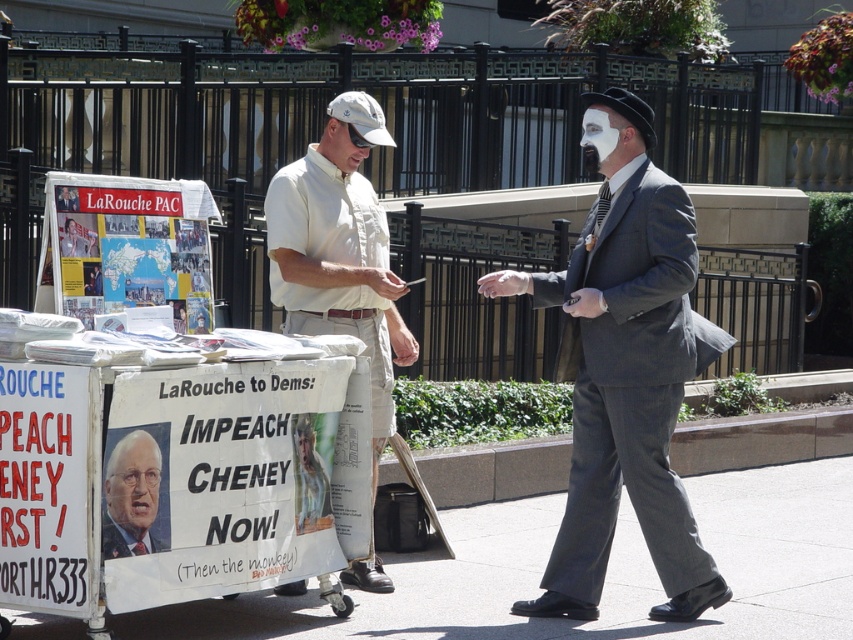
You are standing in front of the street vendor cart. There are two points marked on the cart. The first point is at coordinate point (518, 566) and the second is at point (143, 496). Which point is closer to you?

Point (518, 566) is further to the viewer than point (143, 496), so the second point is closer to you.

You are a pedestrian walking on the gray asphalt pavement at lower center and want to approach the light beige cotton shirt at center. Can you walk straight ahead to reach it?

The gray asphalt pavement at lower center is in front of the light beige cotton shirt at center, so yes, you can walk straight ahead to reach it.

You are standing at the point marked as point [618,518] in the image. The camera is 11.27 meters away from you. If you want to take a photo of the street vendor cart from this position, will the entire cart fit in your camera frame? Assume your camera has a 50mm lens and a field of view of 46 degrees.

The camera is 11.27 meters away from point [618,518]. To determine if the entire cart fits, calculate the maximum width the camera can capture at that distance using the field of view formula. The field of view width is 2 x distance x tan fov angle. Plugging in values gives 2 x 11.27m x tan 23 degrees. This equals approximately 2 x 11.27 x 0.424 equals around 9.6 meters. If the cart is narrower than 9.6 meters, it will fit. Since street vendor carts are typically much smaller, the entire cart should fit.